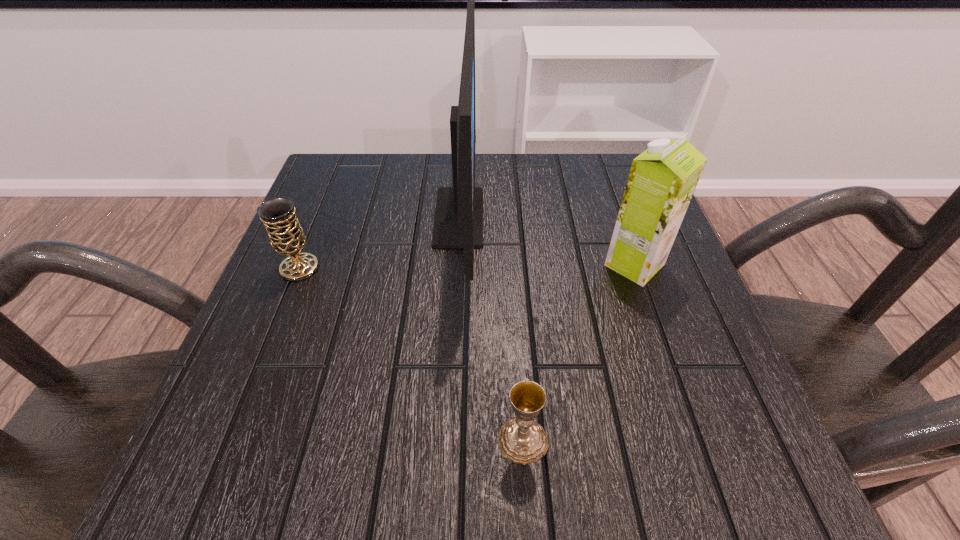
Locate an element on the screen. This screenshot has height=540, width=960. free spot at the far left corner of the desktop is located at coordinates (377, 160).

Image resolution: width=960 pixels, height=540 pixels. In order to click on free space at the near left corner in this screenshot , I will do `click(248, 433)`.

In the image, there is a desktop. Identify the location of vacant space at the far right corner. (614, 191).

Locate an element on the screen. Image resolution: width=960 pixels, height=540 pixels. vacant space at the near right corner of the desktop is located at coordinates (x=747, y=474).

Where is `vacant area between the shorter chalice and the tallest object`? Image resolution: width=960 pixels, height=540 pixels. vacant area between the shorter chalice and the tallest object is located at coordinates (491, 329).

Find the location of a particular element. Image resolution: width=960 pixels, height=540 pixels. vacant point located between the third tallest object and the tallest object is located at coordinates (379, 242).

Where is `free area in between the second tallest object and the computer monitor`? The width and height of the screenshot is (960, 540). free area in between the second tallest object and the computer monitor is located at coordinates (547, 241).

Locate an element on the screen. The height and width of the screenshot is (540, 960). empty location between the left chalice and the computer monitor is located at coordinates (379, 242).

The width and height of the screenshot is (960, 540). In order to click on free area in between the third object from left to right and the second shortest object in this screenshot , I will do `click(411, 354)`.

Locate an element on the screen. empty space that is in between the third tallest object and the shortest object is located at coordinates (411, 354).